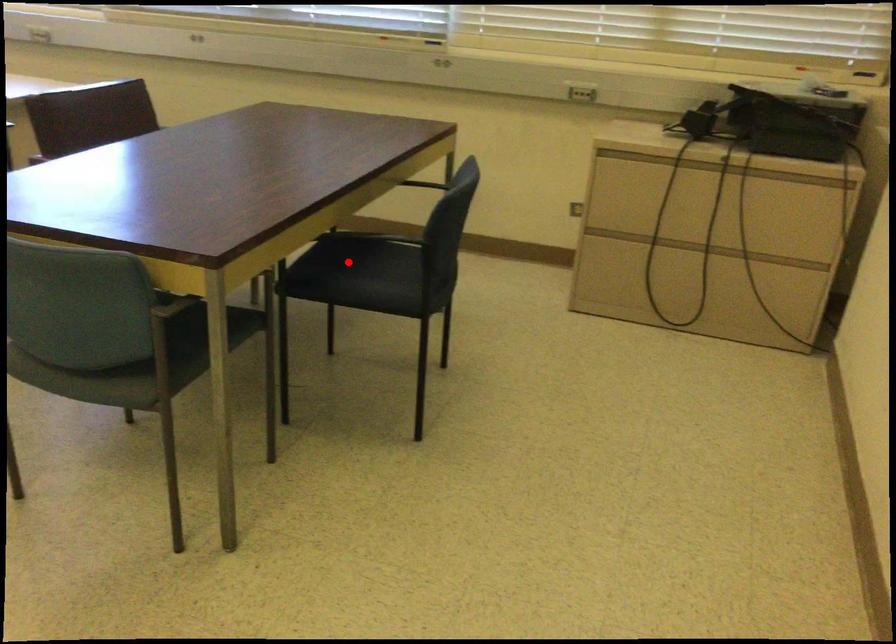
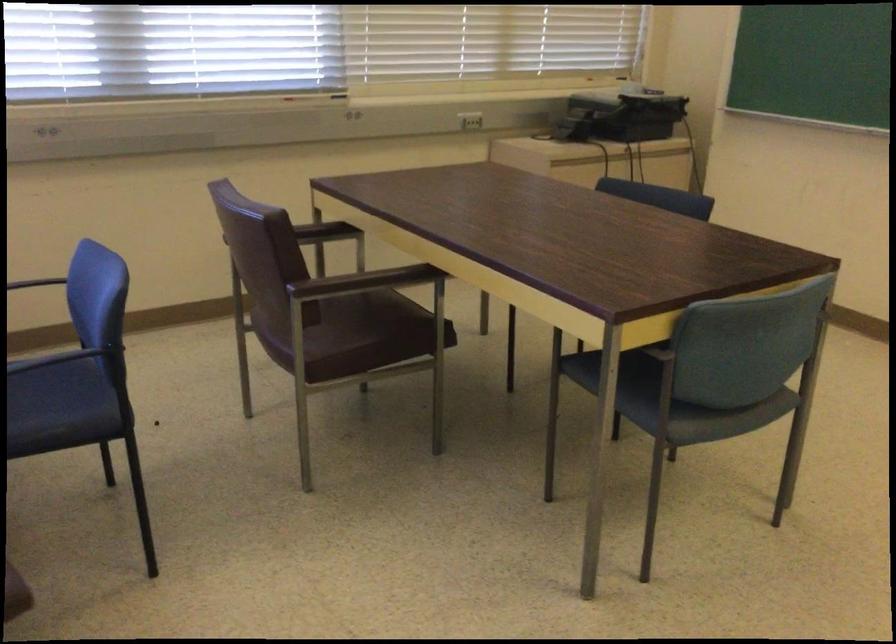
Question: I am providing you with two images of the same scene from different viewpoints. A red point is marked on the first image. Can you still see the location of the red point in image 2?

Choices:
 (A) Yes
 (B) No

Answer: (B)